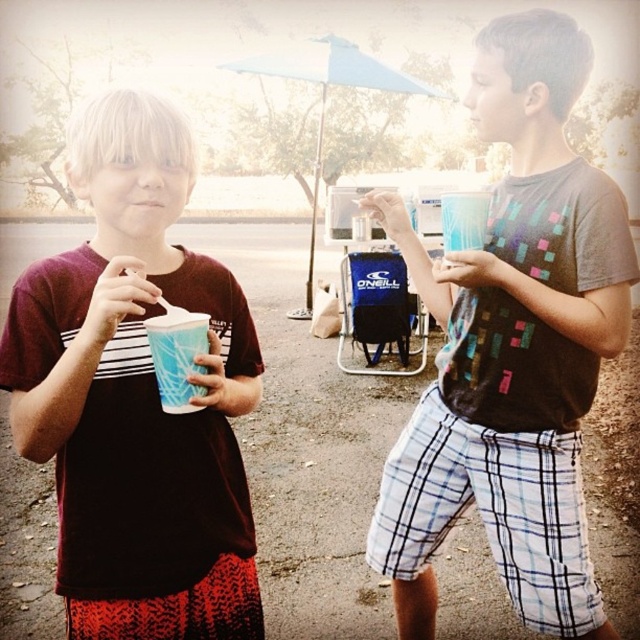
In the scene shown: Who is positioned more to the left, blue fabric umbrella at center or blue paper cup at left?

From the viewer's perspective, blue paper cup at left appears more on the left side.

Is blue fabric umbrella at center to the left of blue paper cup at left from the viewer's perspective?

Incorrect, blue fabric umbrella at center is not on the left side of blue paper cup at left.

Is point (323, 42) positioned before point (180, 316)?

No, it is behind (180, 316).

The width and height of the screenshot is (640, 640). I want to click on blue fabric umbrella at center, so click(324, 100).

Does matte plastic cup at center have a larger size compared to blue fabric umbrella at center?

Yes, matte plastic cup at center is bigger than blue fabric umbrella at center.

Which is behind, point (128, 168) or point (348, 49)?

The point (348, 49) is behind.

The height and width of the screenshot is (640, 640). I want to click on matte plastic cup at center, so click(x=136, y=396).

This screenshot has height=640, width=640. Find the location of `matte plastic cup at center`. matte plastic cup at center is located at coordinates (136, 396).

Can you confirm if matte plastic cup at right is smaller than blue fabric umbrella at center?

Incorrect, matte plastic cup at right is not smaller in size than blue fabric umbrella at center.

Is matte plastic cup at right taller than blue fabric umbrella at center?

Correct, matte plastic cup at right is much taller as blue fabric umbrella at center.

Is point (554, 70) positioned after point (301, 310)?

No.

Identify the location of matte plastic cup at right. (513, 348).